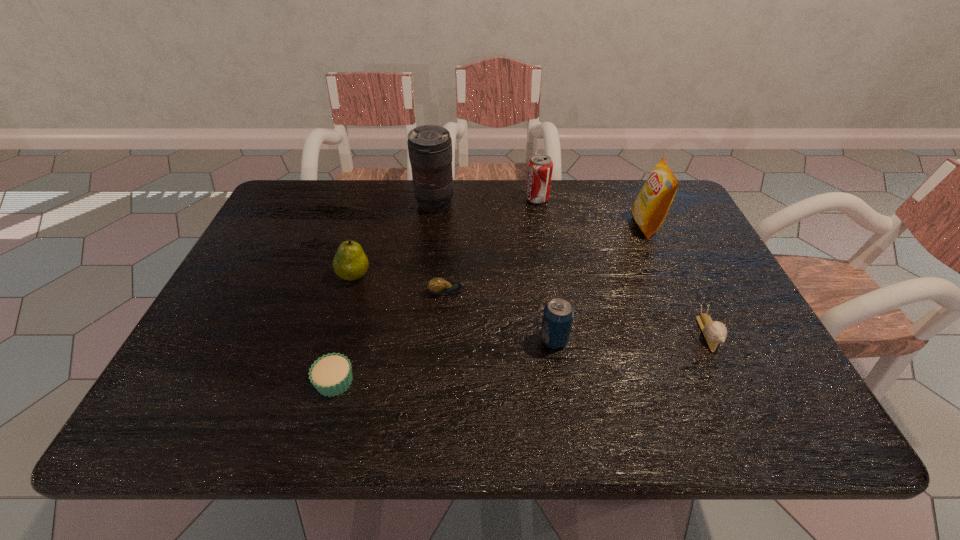
Where is `vacant region located on the front-facing side of the crisp (potato chip)`? The height and width of the screenshot is (540, 960). vacant region located on the front-facing side of the crisp (potato chip) is located at coordinates (506, 225).

Locate an element on the screen. The height and width of the screenshot is (540, 960). free region located 0.200m on the front-facing side of the crisp (potato chip) is located at coordinates (563, 225).

Locate an element on the screen. free space located 0.190m on the front-facing side of the crisp (potato chip) is located at coordinates (565, 225).

The width and height of the screenshot is (960, 540). I want to click on vacant space located on the left of the third tallest object, so click(x=480, y=199).

Identify the location of free space located on the back of the pear. (370, 224).

Locate an element on the screen. This screenshot has width=960, height=540. free location located 0.240m on the left of the nearer pop soda is located at coordinates pyautogui.click(x=431, y=339).

You are a GUI agent. You are given a task and a screenshot of the screen. Output one action in this format:
    pyautogui.click(x=<x>, y=<y>)
    Task: Click on the vacant space located on the front-facing side of the farther escargot
    
    Given the screenshot: What is the action you would take?
    pyautogui.click(x=514, y=292)

Locate an element on the screen. The height and width of the screenshot is (540, 960). free spot located on the shell of the nearer escargot is located at coordinates (730, 377).

Identify the location of vacant area located on the front of the cupcake. Image resolution: width=960 pixels, height=540 pixels. (322, 429).

This screenshot has height=540, width=960. I want to click on telephoto lens at the far edge, so click(x=429, y=146).